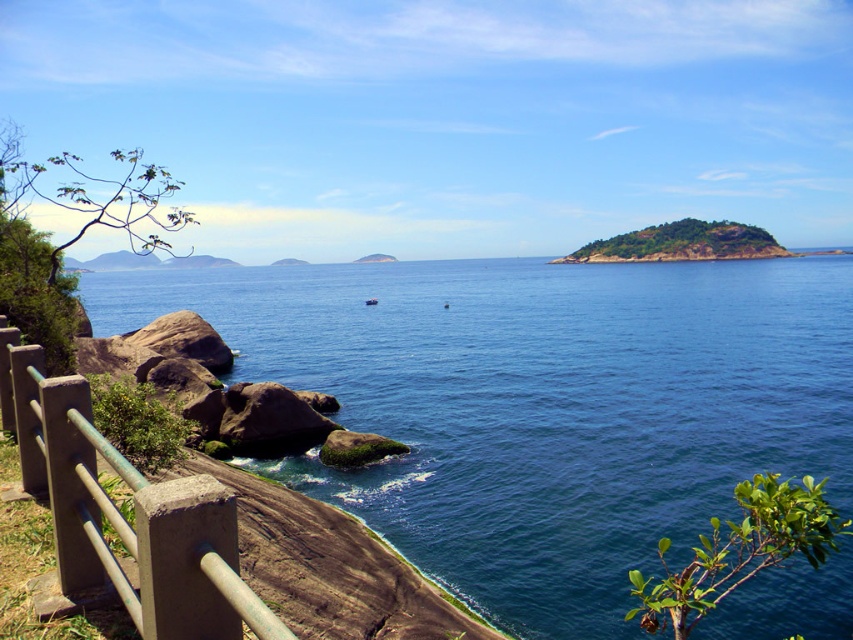
Question: Is deep blue water at center to the right of green mossy rock at center from the viewer's perspective?

Choices:
 (A) no
 (B) yes

Answer: (A)

Question: Is deep blue water at center below green mossy rock at center?

Choices:
 (A) yes
 (B) no

Answer: (A)

Question: Is deep blue water at center above green concrete railing at lower left?

Choices:
 (A) yes
 (B) no

Answer: (A)

Question: Which point appears farthest from the camera in this image?

Choices:
 (A) (759, 250)
 (B) (659, 292)

Answer: (A)

Question: Among these objects, which one is farthest from the camera?

Choices:
 (A) green mossy rock at center
 (B) green concrete railing at lower left
 (C) deep blue water at center

Answer: (A)

Question: Which is nearer to the deep blue water at center?

Choices:
 (A) green concrete railing at lower left
 (B) green mossy rock at center

Answer: (A)